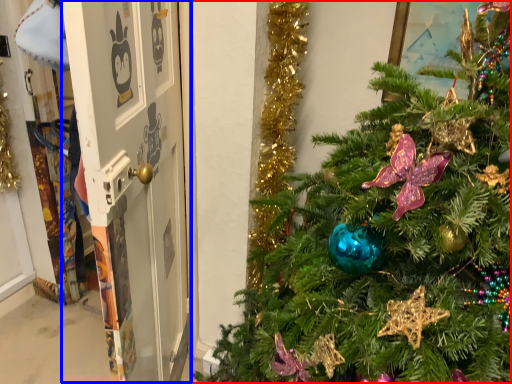
Question: Which object appears farthest to the camera in this image, christmas tree (highlighted by a red box) or screen door (highlighted by a blue box)?

Choices:
 (A) christmas tree
 (B) screen door

Answer: (B)